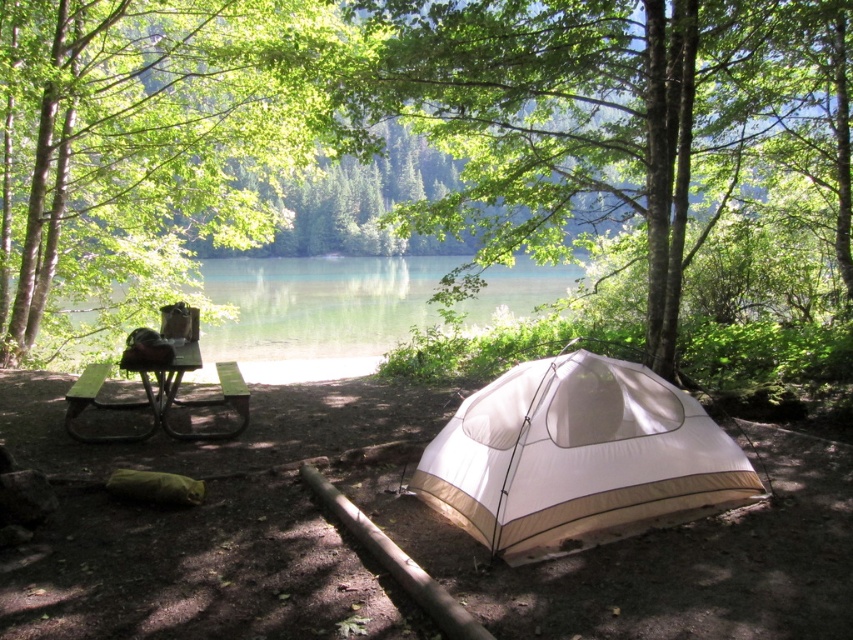
Question: Which of the following is the closest to the observer?

Choices:
 (A) clear water at center
 (B) green leafy tree at center
 (C) green leafy tree at left

Answer: (B)

Question: Among these points, which one is nearest to the camera?

Choices:
 (A) (468, 316)
 (B) (115, 182)
 (C) (669, 518)

Answer: (C)

Question: Which object is positioned farthest from the clear water at center?

Choices:
 (A) green leafy tree at center
 (B) green painted wood picnic table at center-left
 (C) green leafy tree at left
 (D) white nylon tent at center

Answer: (D)

Question: Can you confirm if green leafy tree at center is positioned to the right of green leafy tree at left?

Choices:
 (A) no
 (B) yes

Answer: (B)

Question: Can you confirm if green leafy tree at center is thinner than green painted wood picnic table at center-left?

Choices:
 (A) yes
 (B) no

Answer: (B)

Question: Does green leafy tree at left appear on the right side of white nylon tent at center?

Choices:
 (A) no
 (B) yes

Answer: (A)